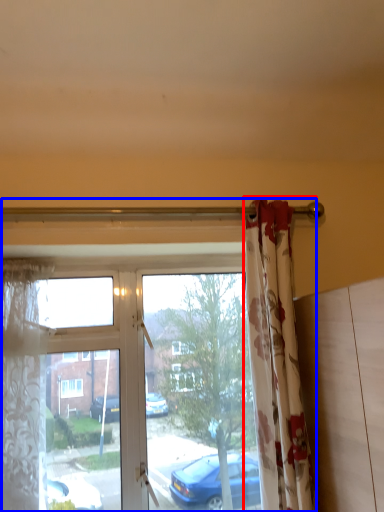
Question: Which object appears farthest to the camera in this image, curtain (highlighted by a red box) or window (highlighted by a blue box)?

Choices:
 (A) curtain
 (B) window

Answer: (B)